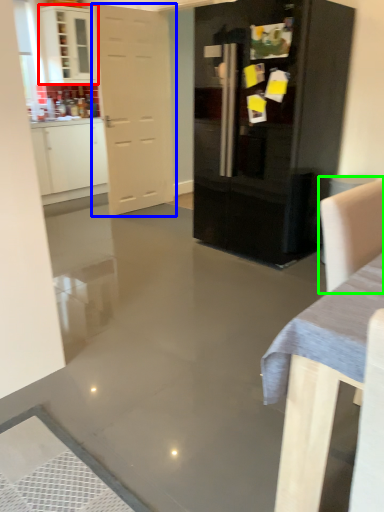
Question: Which object is the closest to the cabinetry (highlighted by a red box)? Choose among these: door (highlighted by a blue box) or armchair (highlighted by a green box).

Choices:
 (A) door
 (B) armchair

Answer: (A)